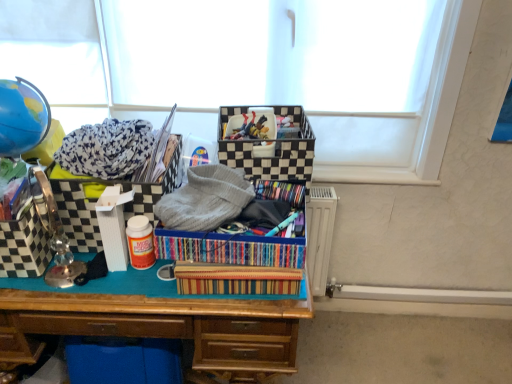
Where is `gray knitted sweater at center`? The height and width of the screenshot is (384, 512). gray knitted sweater at center is located at coordinates (205, 199).

What do you see at coordinates (28, 237) in the screenshot? Image resolution: width=512 pixels, height=384 pixels. I see `checkerboard-patterned storage box at left, acting as the third storage box starting from the right` at bounding box center [28, 237].

What is the approximate height of striped fabric crate at center?

striped fabric crate at center is 3.00 inches in height.

What do you see at coordinates (158, 319) in the screenshot?
I see `wooden desk at center` at bounding box center [158, 319].

What is the approximate height of multicolored striped fabric at center?

4.00 inches.

In order to click on gray knitted sweater at center in this screenshot , I will do `click(205, 199)`.

Is the surface of wooden desk at center in direct contact with checkerboard-patterned storage box at left, acting as the third storage box starting from the right?

There is a gap between wooden desk at center and checkerboard-patterned storage box at left, acting as the third storage box starting from the right.

Is wooden desk at center further to the viewer compared to checkerboard-patterned storage box at left, which is the 1th storage box in left-to-right order?

No, wooden desk at center is closer to the viewer.

Considering the points (19, 354) and (29, 212), which point is in front, point (19, 354) or point (29, 212)?

The point (29, 212) is more forward.

Considering the positions of objects gray knitted sweater at center and multicolored striped fabric at center in the image provided, who is behind, gray knitted sweater at center or multicolored striped fabric at center?

multicolored striped fabric at center is further from the camera.

Which is nearer, (184, 210) or (221, 172)?

Point (184, 210) appears to be closer to the viewer than point (221, 172).

Does gray knitted sweater at center have a greater width compared to multicolored striped fabric at center?

No, gray knitted sweater at center is not wider than multicolored striped fabric at center.

Is gray knitted sweater at center oriented away from multicolored striped fabric at center?

gray knitted sweater at center is not turned away from multicolored striped fabric at center.

In the scene shown: Is black checkered storage box at center, the third storage box in the left-to-right sequence, next to multicolored striped fabric at center and touching it?

No.

Based on the photo, from a real-world perspective, relative to multicolored striped fabric at center, is black checkered storage box at center, the third storage box in the left-to-right sequence, vertically above or below?

In terms of real-world spatial position, black checkered storage box at center, the third storage box in the left-to-right sequence, is above multicolored striped fabric at center.

From the image's perspective, is black checkered storage box at center, the third storage box in the left-to-right sequence, located above or below multicolored striped fabric at center?

black checkered storage box at center, the third storage box in the left-to-right sequence, is above multicolored striped fabric at center.

Consider the image. Does wooden desk at center have a lesser height compared to multicolored striped fabric at center?

In fact, wooden desk at center may be taller than multicolored striped fabric at center.

From the image's perspective, is wooden desk at center positioned above or below multicolored striped fabric at center?

From the image's perspective, wooden desk at center appears below multicolored striped fabric at center.

Is wooden desk at center at the left side of multicolored striped fabric at center?

Indeed, wooden desk at center is positioned on the left side of multicolored striped fabric at center.

Could you tell me if wooden desk at center is facing multicolored striped fabric at center?

No, wooden desk at center is not turned towards multicolored striped fabric at center.

What's the angular difference between checkered fabric storage box at left, the 2th storage box positioned from the left, and striped fabric crate at center's facing directions?

There is a 0.308-degree angle between the facing directions of checkered fabric storage box at left, the 2th storage box positioned from the left, and striped fabric crate at center.

Consider the image. From a real-world perspective, is checkered fabric storage box at left, the 2th storage box positioned from the left, physically below striped fabric crate at center?

No, from a real-world perspective, checkered fabric storage box at left, the 2th storage box positioned from the left, is not beneath striped fabric crate at center.

Is checkered fabric storage box at left, the 2th storage box positioned from the left, looking in the opposite direction of striped fabric crate at center?

No, checkered fabric storage box at left, the 2th storage box positioned from the left, is not facing away from striped fabric crate at center.

Is checkered fabric storage box at left, the 2th storage box positioned from the left, placed right next to striped fabric crate at center?

No, checkered fabric storage box at left, the 2th storage box positioned from the left, is not with striped fabric crate at center.

Can we say checkered fabric storage box at left, the 2th storage box positioned from the left, lies outside gray knitted sweater at center?

Yes.

From the image's perspective, is checkered fabric storage box at left, the 2th storage box positioned from the left, located above gray knitted sweater at center?

Yes, from the image's perspective, checkered fabric storage box at left, the 2th storage box positioned from the left, is on top of gray knitted sweater at center.

Is point (119, 183) positioned in front of point (163, 224)?

That is False.

Is checkered fabric storage box at left, the 2th storage box positioned from the left, looking in the opposite direction of gray knitted sweater at center?

No, checkered fabric storage box at left, the 2th storage box positioned from the left, is not facing away from gray knitted sweater at center.

Considering the relative positions of multicolored striped fabric at center and gray knitted sweater at center in the image provided, is multicolored striped fabric at center to the right of gray knitted sweater at center from the viewer's perspective?

Yes.

Which object is more forward, multicolored striped fabric at center or gray knitted sweater at center?

gray knitted sweater at center.

Is gray knitted sweater at center inside multicolored striped fabric at center?

No, gray knitted sweater at center is not inside multicolored striped fabric at center.

Starting from the wooden desk at center, which storage box is the 2nd one to the left? Please provide its 2D coordinates.

[(28, 237)]

In the image, there is a gray knitted sweater at center. In order to click on kit below it (from a real-world perspective) in this screenshot , I will do `click(217, 224)`.

Which object lies further to the anchor point black checkered storage box at center, the first storage box viewed from the right, checkerboard-patterned storage box at left, which is the 1th storage box in left-to-right order, or striped fabric crate at center?

checkerboard-patterned storage box at left, which is the 1th storage box in left-to-right order, lies further to black checkered storage box at center, the first storage box viewed from the right, than the other object.

Looking at the image, which one is located further to wooden desk at center, black checkered storage box at center, the third storage box in the left-to-right sequence, or multicolored striped fabric at center?

The object further to wooden desk at center is black checkered storage box at center, the third storage box in the left-to-right sequence.

Which object lies further to the anchor point wooden desk at center, checkerboard-patterned storage box at left, which is the 1th storage box in left-to-right order, or gray knitted sweater at center?

gray knitted sweater at center is further to wooden desk at center.

Based on the photo, when comparing their distances from multicolored striped fabric at center, does checkerboard-patterned storage box at left, which is the 1th storage box in left-to-right order, or black checkered storage box at center, the first storage box viewed from the right, seem further?

checkerboard-patterned storage box at left, which is the 1th storage box in left-to-right order, is further to multicolored striped fabric at center.

Looking at the image, which one is located further to black checkered storage box at center, the third storage box in the left-to-right sequence, checkerboard-patterned storage box at left, which is the 1th storage box in left-to-right order, or checkered fabric storage box at left, which is the 2th storage box from right to left?

checkerboard-patterned storage box at left, which is the 1th storage box in left-to-right order, lies further to black checkered storage box at center, the third storage box in the left-to-right sequence, than the other object.

Estimate the real-world distances between objects in this image. Which object is further from multicolored striped fabric at center, wooden desk at center or checkered fabric storage box at left, the 2th storage box positioned from the left?

Based on the image, wooden desk at center appears to be further to multicolored striped fabric at center.

When comparing their distances from checkered fabric storage box at left, the 2th storage box positioned from the left, does wooden desk at center or black checkered storage box at center, the first storage box viewed from the right, seem closer?

wooden desk at center.

From the image, which object appears to be nearer to striped fabric crate at center, multicolored striped fabric at center or wooden desk at center?

The object closer to striped fabric crate at center is multicolored striped fabric at center.

This screenshot has height=384, width=512. Find the location of `crate between black checkered storage box at center, the first storage box viewed from the right, and wooden desk at center in the up-down direction`. crate between black checkered storage box at center, the first storage box viewed from the right, and wooden desk at center in the up-down direction is located at coordinates (229, 248).

Where is `kit between gray knitted sweater at center and striped fabric crate at center in the vertical direction`? kit between gray knitted sweater at center and striped fabric crate at center in the vertical direction is located at coordinates (217, 224).

You are a GUI agent. You are given a task and a screenshot of the screen. Output one action in this format:
    pyautogui.click(x=<x>, y=<y>)
    Task: Click on the clothing between checkered fabric storage box at left, which is the 2th storage box from right to left, and black checkered storage box at center, the third storage box in the left-to-right sequence, from left to right
    The width and height of the screenshot is (512, 384).
    Given the screenshot: What is the action you would take?
    pyautogui.click(x=205, y=199)

Locate an element on the screen. The width and height of the screenshot is (512, 384). kit between checkered fabric storage box at left, the 2th storage box positioned from the left, and striped fabric crate at center from left to right is located at coordinates (217, 224).